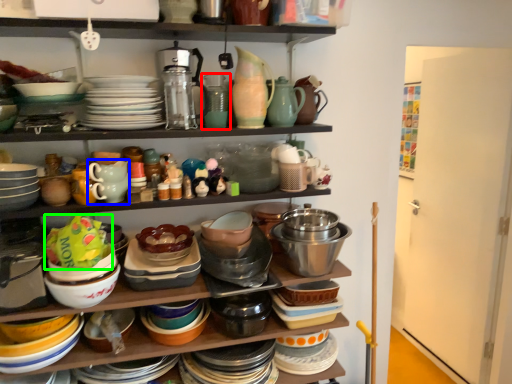
Question: Which is nearer to the tableware (highlighted by a red box)? tableware (highlighted by a blue box) or food (highlighted by a green box).

Choices:
 (A) tableware
 (B) food

Answer: (A)